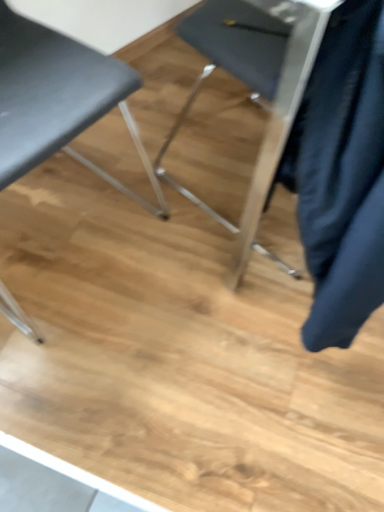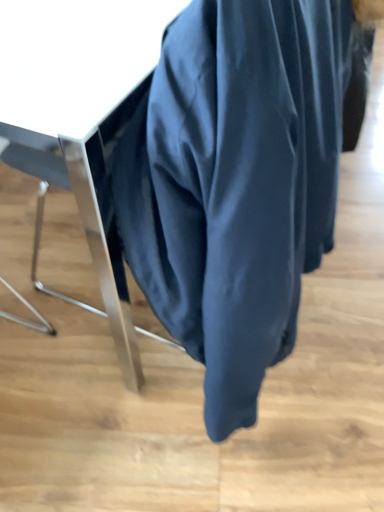
Question: How did the camera likely rotate when shooting the video?

Choices:
 (A) rotated downward
 (B) rotated upward

Answer: (B)